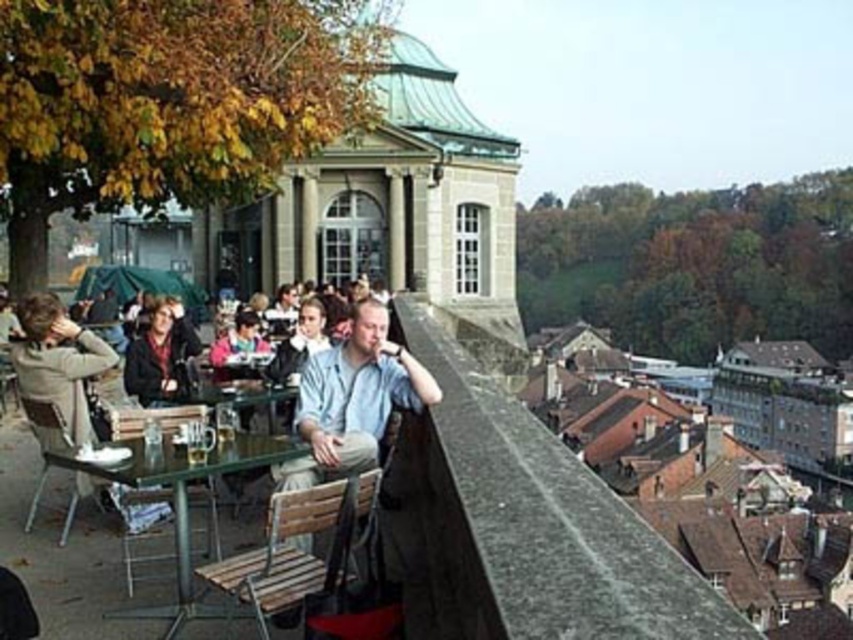
Question: Does green glass table at center have a lesser width compared to light brown leather jacket at lower left?

Choices:
 (A) no
 (B) yes

Answer: (B)

Question: In this image, where is light blue fabric shirt at center located relative to pink fabric jacket at center?

Choices:
 (A) below
 (B) above

Answer: (B)

Question: Which object appears farthest from the camera in this image?

Choices:
 (A) pink fabric jacket at center
 (B) light brown leather jacket at lower left
 (C) green glass table at center
 (D) light blue fabric shirt at center

Answer: (A)

Question: Which of these objects is positioned closest to the light blue fabric shirt at center?

Choices:
 (A) green glass table at center
 (B) pink fabric jacket at center

Answer: (A)

Question: From the image, what is the correct spatial relationship of green glass table at center in relation to matte black jacket at center?

Choices:
 (A) left
 (B) right

Answer: (B)

Question: Which object appears closest to the camera in this image?

Choices:
 (A) green glass table at center
 (B) light brown leather jacket at lower left
 (C) pink fabric jacket at center
 (D) light blue fabric shirt at center

Answer: (D)